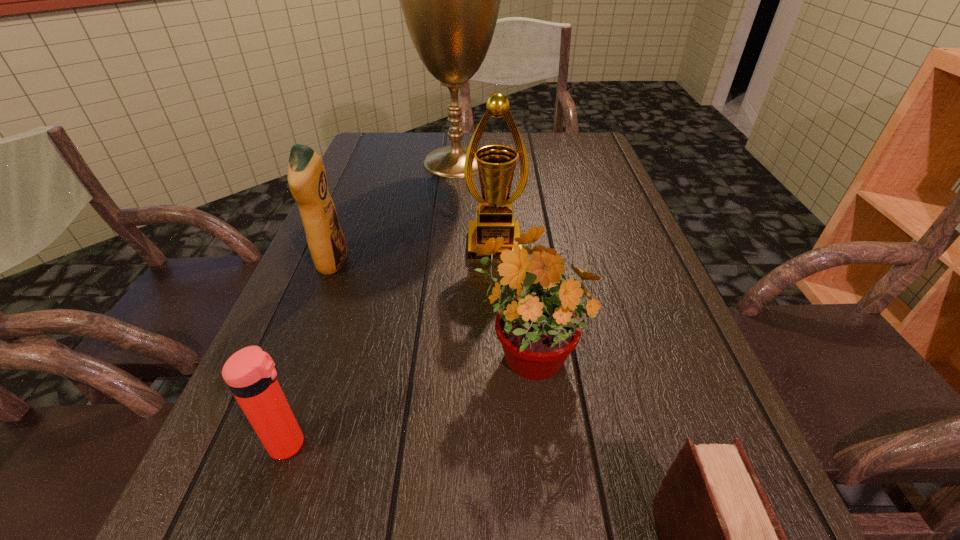
Find the location of a particular element. free space between the farthest object and the fifth tallest object is located at coordinates (372, 303).

Identify the location of free point between the fifth shortest object and the tallest object. (475, 203).

Find the location of `empty location between the award and the thermos bottle`. empty location between the award and the thermos bottle is located at coordinates (392, 345).

Locate which object is the fourth closest to the second tallest object. Please provide its 2D coordinates. Your answer should be formatted as a tuple, i.e. [(x, y)], where the tuple contains the x and y coordinates of a point satisfying the conditions above.

[(250, 373)]

The height and width of the screenshot is (540, 960). I want to click on object that is the fifth closest one to the detergent, so click(x=720, y=539).

I want to click on free location that satisfies the following two spatial constraints: 1. on the front-facing side of the award; 2. on the label of the detergent, so click(495, 263).

This screenshot has height=540, width=960. What are the coordinates of `free space that satisfies the following two spatial constraints: 1. on the label of the detergent; 2. on the back side of the flowerpot` in the screenshot? It's located at (298, 349).

This screenshot has width=960, height=540. What are the coordinates of `free region that satisfies the following two spatial constraints: 1. on the front-facing side of the flowerpot; 2. on the left side of the award` in the screenshot? It's located at (498, 349).

Identify the location of vacant region that satisfies the following two spatial constraints: 1. on the label of the detergent; 2. on the right side of the third nearest object. This screenshot has width=960, height=540. (298, 349).